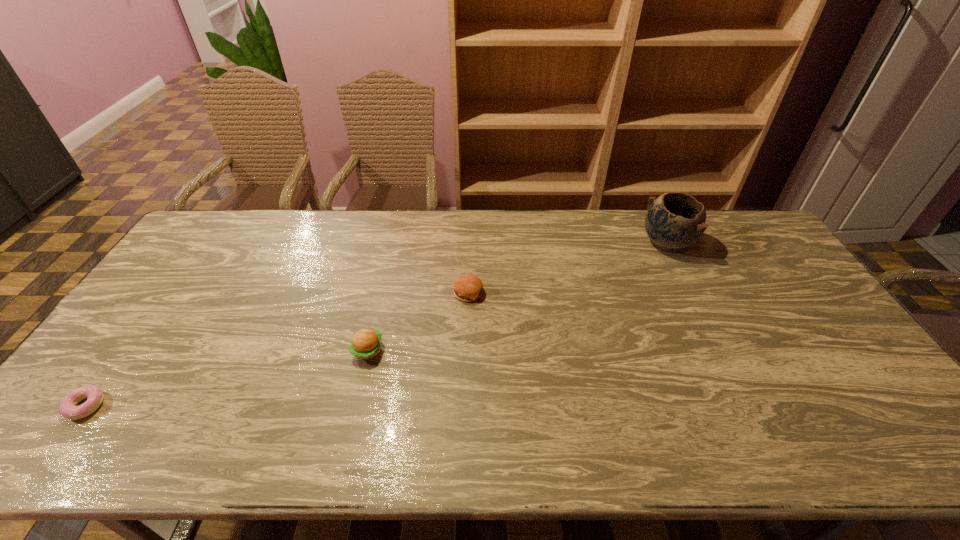
This screenshot has height=540, width=960. I want to click on blank space located 0.250m on the left of the shorter hamburger, so click(372, 293).

At what (x,y) coordinates should I click in order to perform the action: click on vacant space located on the right of the doughnut. Please return your answer as a coordinate pair (x, y). This screenshot has height=540, width=960. Looking at the image, I should click on (252, 406).

Where is `object present at the far edge`? The width and height of the screenshot is (960, 540). object present at the far edge is located at coordinates (675, 220).

This screenshot has width=960, height=540. In order to click on object that is at the left edge in this screenshot , I will do `click(94, 395)`.

The image size is (960, 540). What are the coordinates of `free space at the far edge of the desktop` in the screenshot? It's located at (289, 222).

The image size is (960, 540). I want to click on free space at the near edge of the desktop, so click(722, 445).

In the image, there is a desktop. What are the coordinates of `vacant space at the left edge` in the screenshot? It's located at (202, 287).

Image resolution: width=960 pixels, height=540 pixels. I want to click on free location at the right edge, so click(786, 276).

Image resolution: width=960 pixels, height=540 pixels. I want to click on vacant space at the far left corner of the desktop, so click(232, 219).

The image size is (960, 540). Identify the location of vacant space at the near left corner of the desktop. (44, 428).